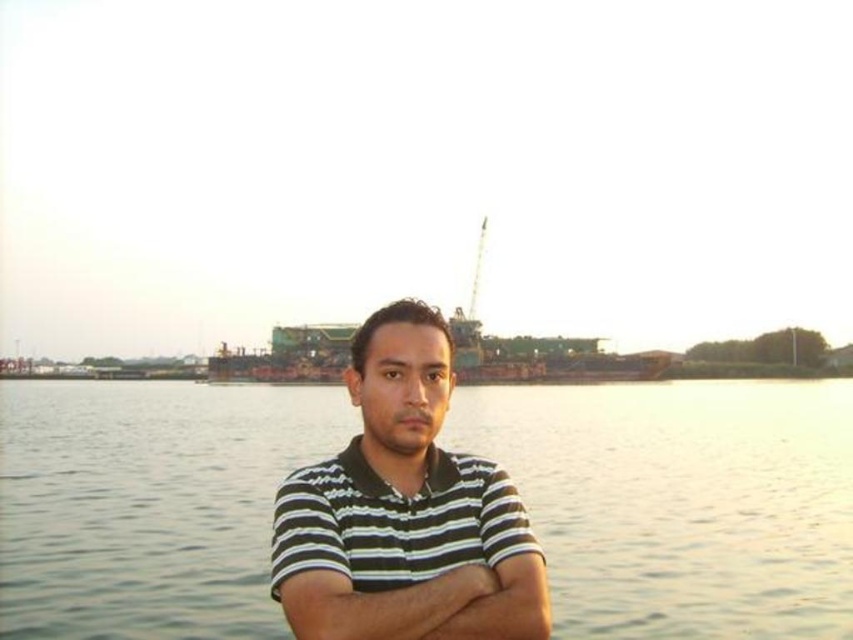
Question: Which object is positioned closest to the white striped shirt at center?

Choices:
 (A) clear water at center
 (B) striped fabric arm at center

Answer: (B)

Question: Can you confirm if clear water at center is bigger than white striped shirt at center?

Choices:
 (A) yes
 (B) no

Answer: (A)

Question: Which object appears closest to the camera in this image?

Choices:
 (A) clear water at center
 (B) striped cotton shirt at center

Answer: (B)

Question: Is clear water at center above striped cotton shirt at center?

Choices:
 (A) yes
 (B) no

Answer: (B)

Question: Which object is closer to the camera taking this photo?

Choices:
 (A) striped cotton shirt at center
 (B) striped fabric arm at center
 (C) white striped shirt at center

Answer: (C)

Question: In this image, where is white striped shirt at center located relative to striped fabric arm at center?

Choices:
 (A) below
 (B) above

Answer: (A)